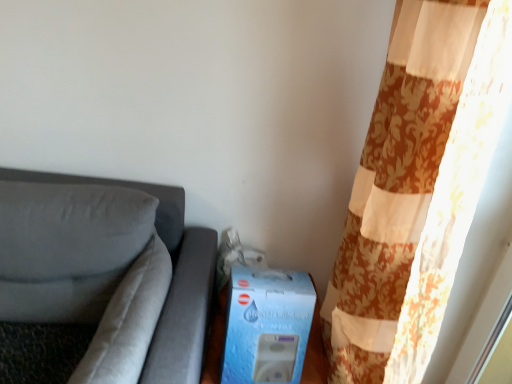
Question: Does floral fabric curtain at right appear on the left side of suede-like gray pillow at left?

Choices:
 (A) no
 (B) yes

Answer: (A)

Question: Is floral fabric curtain at right closer to camera compared to suede-like gray pillow at left?

Choices:
 (A) yes
 (B) no

Answer: (A)

Question: Does floral fabric curtain at right turn towards suede-like gray pillow at left?

Choices:
 (A) yes
 (B) no

Answer: (A)

Question: Does floral fabric curtain at right have a greater width compared to suede-like gray pillow at left?

Choices:
 (A) no
 (B) yes

Answer: (B)

Question: Is floral fabric curtain at right not within suede-like gray pillow at left?

Choices:
 (A) yes
 (B) no

Answer: (A)

Question: Are floral fabric curtain at right and suede-like gray pillow at left beside each other?

Choices:
 (A) yes
 (B) no

Answer: (B)

Question: Considering the relative sizes of suede-like gray pillow at left and blue cardboard box at lower center in the image provided, is suede-like gray pillow at left smaller than blue cardboard box at lower center?

Choices:
 (A) no
 (B) yes

Answer: (A)

Question: Is suede-like gray pillow at left further to the viewer compared to blue cardboard box at lower center?

Choices:
 (A) yes
 (B) no

Answer: (B)

Question: Is blue cardboard box at lower center inside suede-like gray pillow at left?

Choices:
 (A) no
 (B) yes

Answer: (A)

Question: Does suede-like gray pillow at left turn towards blue cardboard box at lower center?

Choices:
 (A) no
 (B) yes

Answer: (A)

Question: Considering the relative sizes of suede-like gray pillow at left and blue cardboard box at lower center in the image provided, is suede-like gray pillow at left thinner than blue cardboard box at lower center?

Choices:
 (A) yes
 (B) no

Answer: (B)

Question: Is suede-like gray pillow at left next to blue cardboard box at lower center?

Choices:
 (A) no
 (B) yes

Answer: (A)

Question: Is floral fabric curtain at right surrounded by suede gray couch at left?

Choices:
 (A) no
 (B) yes

Answer: (A)